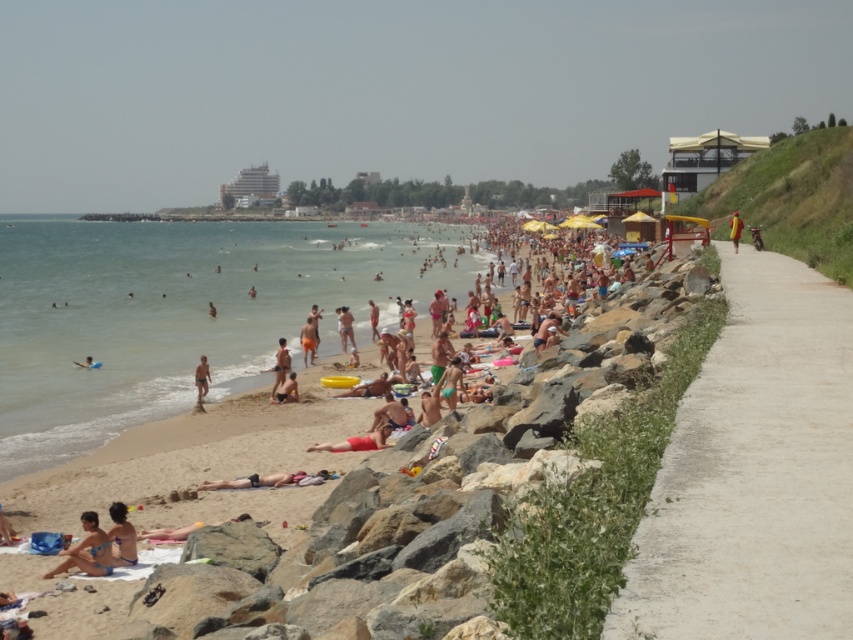
Question: Is tan skin human at center positioned behind tan skin person at center?

Choices:
 (A) yes
 (B) no

Answer: (A)

Question: Which point is farther from the camera taking this photo?

Choices:
 (A) (207, 371)
 (B) (296, 384)
 (C) (209, 310)
 (D) (364, 484)

Answer: (C)

Question: Is light brown sand at center positioned in front of tan skin human at beach center?

Choices:
 (A) no
 (B) yes

Answer: (B)

Question: Estimate the real-world distances between objects in this image. Which object is farther from the tan skin person at center?

Choices:
 (A) tan skin human at center
 (B) matte bikini at lower left
 (C) tan skin human at beach center
 (D) light brown sand at center

Answer: (B)

Question: Which point is farther to the camera?

Choices:
 (A) (73, 554)
 (B) (1, 220)

Answer: (B)

Question: Can you confirm if matte bikini at lower left is positioned below tan skin person at beach center?

Choices:
 (A) yes
 (B) no

Answer: (A)